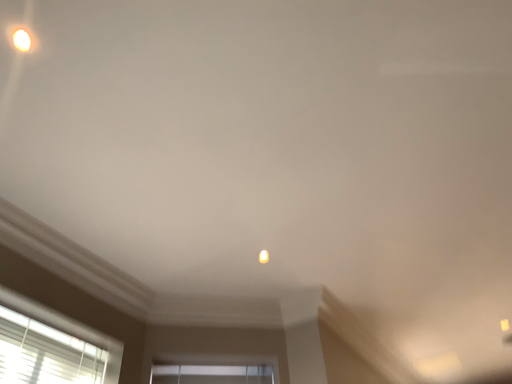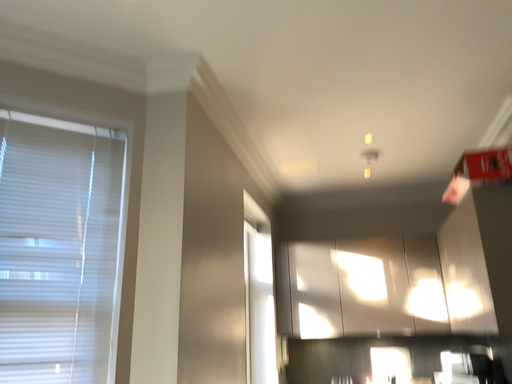
Question: How did the camera likely rotate when shooting the video?

Choices:
 (A) rotated upward
 (B) rotated downward

Answer: (B)